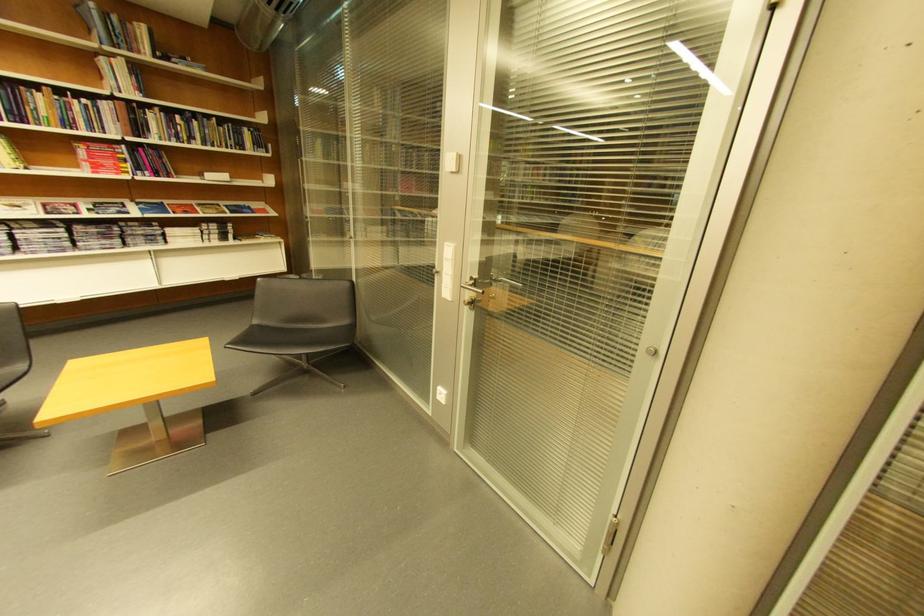
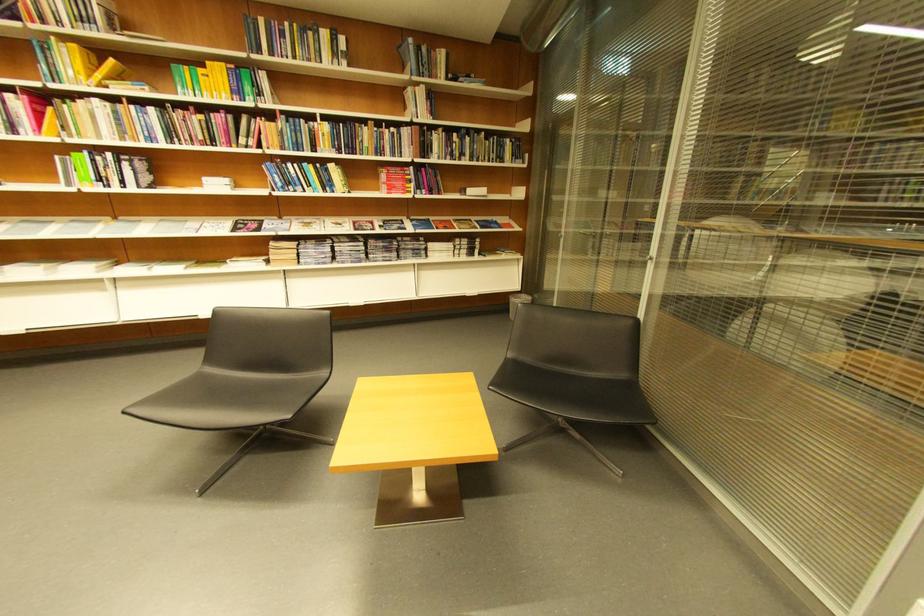
Find the pixel in the second image that matches (x=113, y=62) in the first image.

(419, 91)